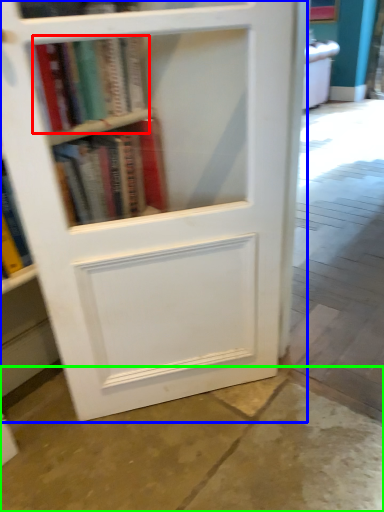
Question: Based on their relative distances, which object is nearer to book (highlighted by a red box)? Choose from bookcase (highlighted by a blue box) and concrete (highlighted by a green box).

Choices:
 (A) bookcase
 (B) concrete

Answer: (A)